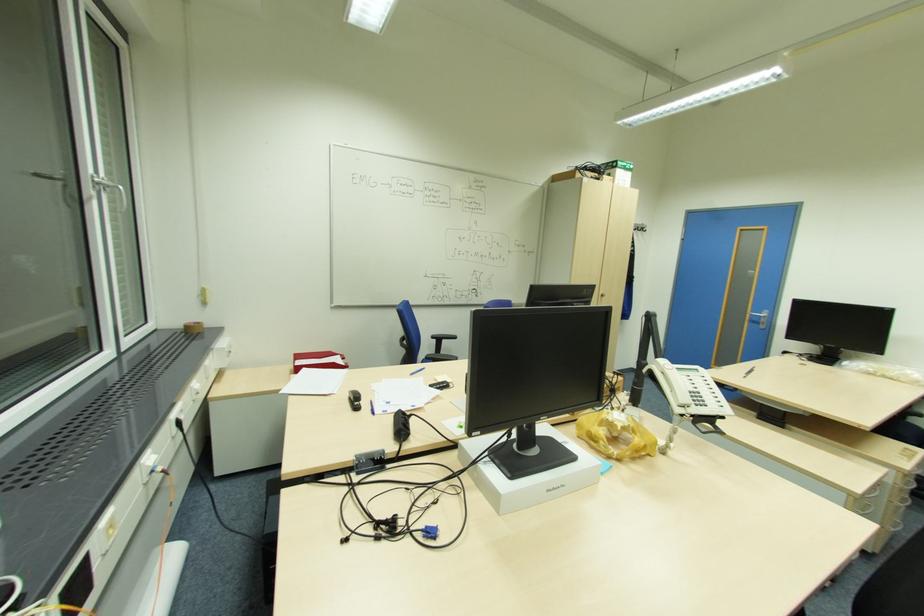
Where would you lift the yellow skull model? Please return your answer as a coordinate pair (x, y).

(614, 435)